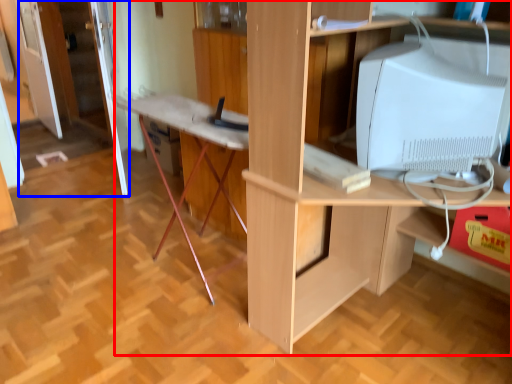
Question: Which object is closer to the camera taking this photo, desk (highlighted by a red box) or door (highlighted by a blue box)?

Choices:
 (A) desk
 (B) door

Answer: (A)